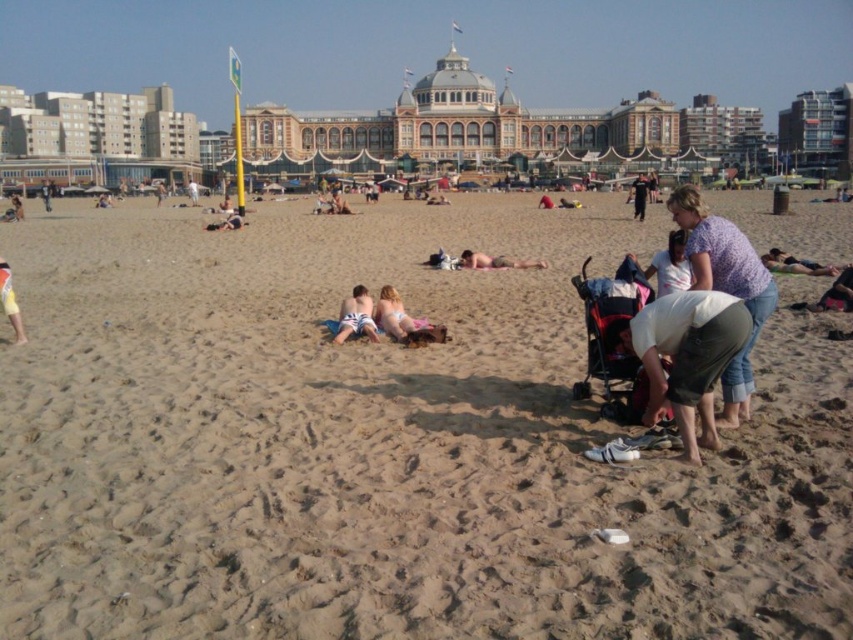
Does smooth sand at center appear over tan skin person at lower right?

No.

Is smooth sand at center shorter than tan skin person at lower right?

No, smooth sand at center is not shorter than tan skin person at lower right.

Does point (281, 388) come farther from viewer compared to point (808, 273)?

No, (281, 388) is closer to viewer.

At what (x,y) coordinates should I click in order to perform the action: click on smooth sand at center. Please return your answer as a coordinate pair (x, y). The height and width of the screenshot is (640, 853). Looking at the image, I should click on (384, 444).

Is matte pink fabric baby carriage at lower right further to camera compared to matte black surfboard at center?

No, matte pink fabric baby carriage at lower right is in front of matte black surfboard at center.

Between matte pink fabric baby carriage at lower right and matte black surfboard at center, which one appears on the right side from the viewer's perspective?

matte pink fabric baby carriage at lower right is more to the right.

Locate an element on the screen. The image size is (853, 640). matte pink fabric baby carriage at lower right is located at coordinates (613, 337).

Between point (3, 300) and point (480, 252), which one is positioned in front?

Positioned in front is point (3, 300).

Is light yellow fabric at lower left smaller than smooth tan skin at center?

No, light yellow fabric at lower left is not smaller than smooth tan skin at center.

Between point (9, 280) and point (473, 260), which one is positioned in front?

Point (9, 280) is more forward.

What are the coordinates of `light yellow fabric at lower left` in the screenshot? It's located at (10, 301).